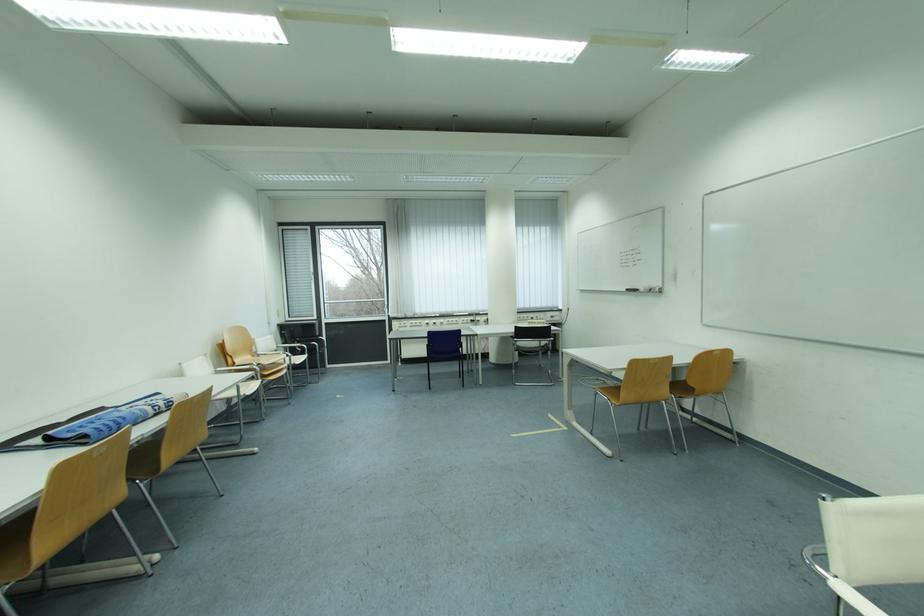
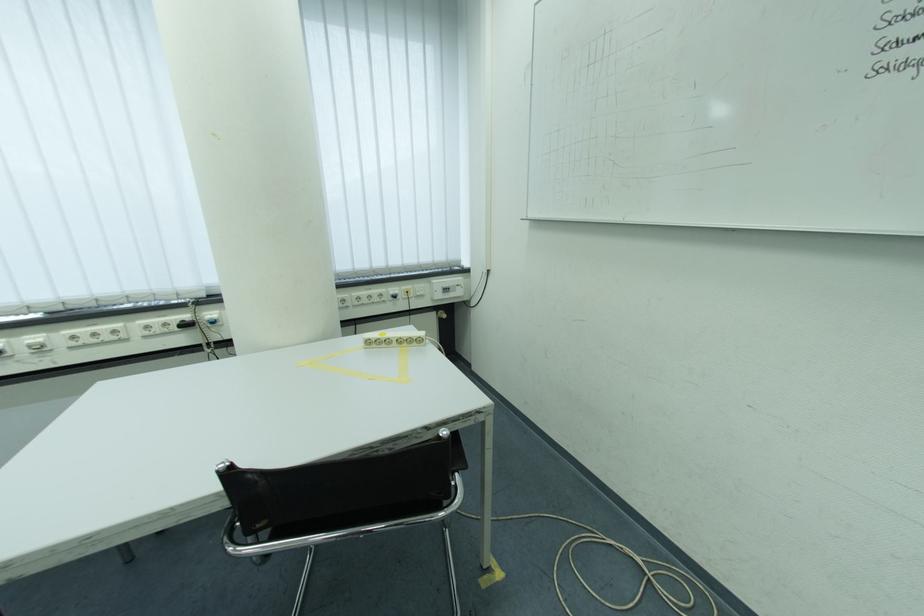
Where in the second image is the point corresponding to point 487,321 from the first image?

(217, 315)